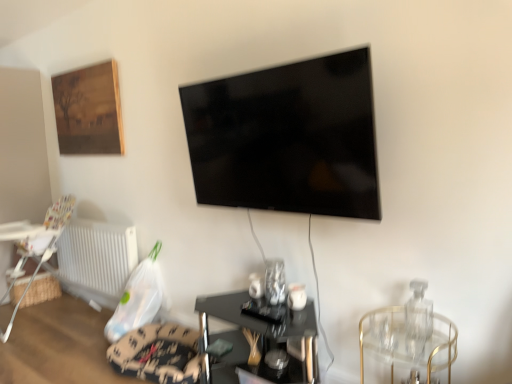
This screenshot has height=384, width=512. Find the location of `vacant space in white plastic highchair at lower left (from a real-world perspective)`. vacant space in white plastic highchair at lower left (from a real-world perspective) is located at coordinates (44, 319).